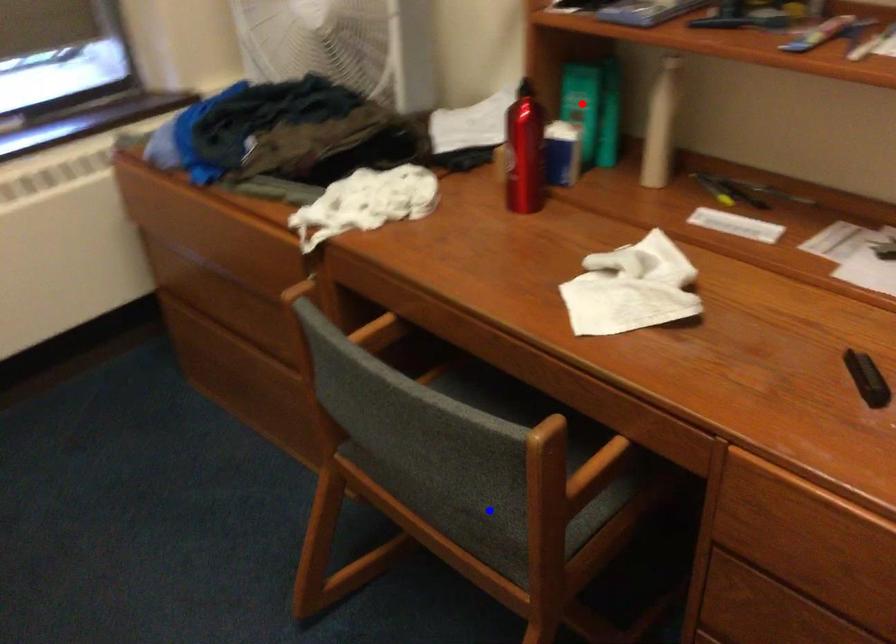
Question: Which of the two points in the image is closer to the camera?

Choices:
 (A) Blue point is closer.
 (B) Red point is closer.

Answer: (A)